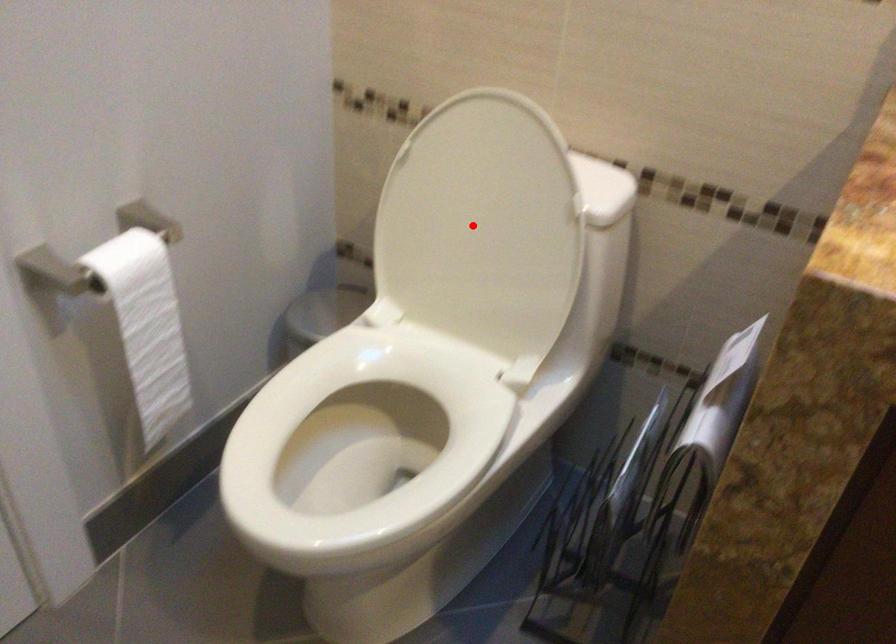
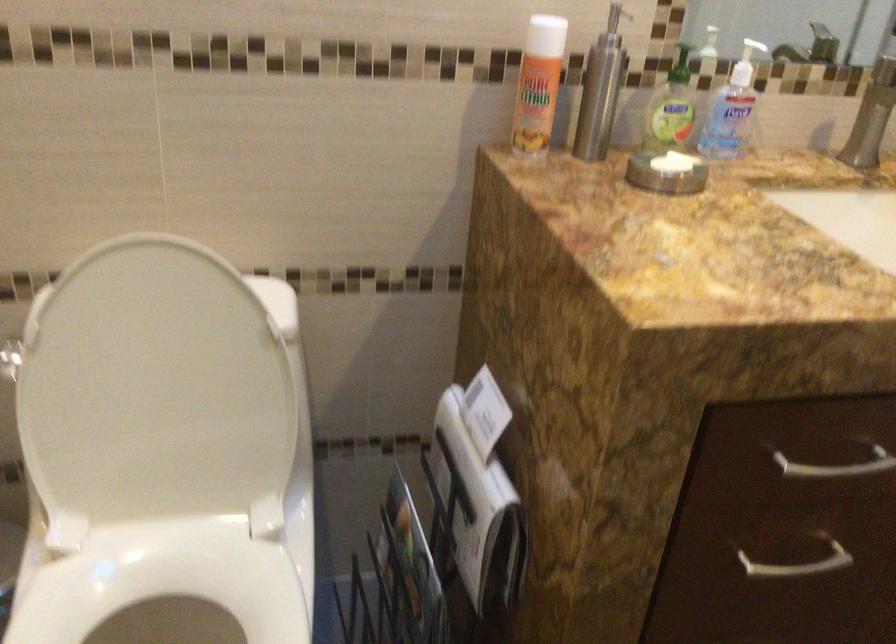
Question: A red point is marked in image1. In image2, is the corresponding 3D point closer to the camera or farther? Reply with the corresponding letter.

Choices:
 (A) The corresponding 3D point is closer.
 (B) The corresponding 3D point is farther.

Answer: (A)